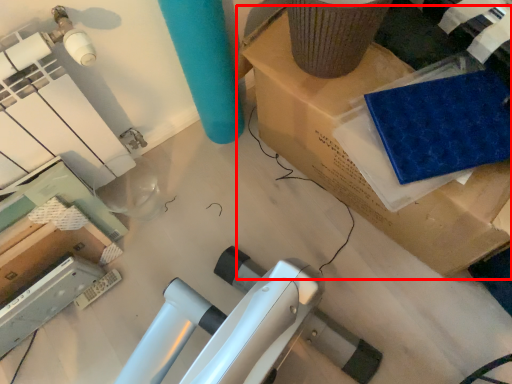
Question: Considering the relative positions of furniture (annotated by the red box) and fabric in the image provided, where is furniture (annotated by the red box) located with respect to the staircase?

Choices:
 (A) left
 (B) right

Answer: (B)